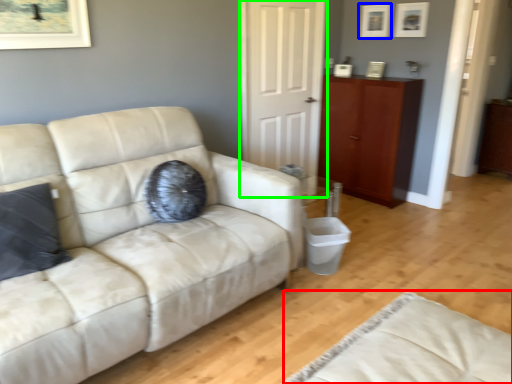
Question: Which object is the closest to the beige (highlighted by a red box)? Choose among these: picture frame (highlighted by a blue box) or door (highlighted by a green box).

Choices:
 (A) picture frame
 (B) door

Answer: (B)